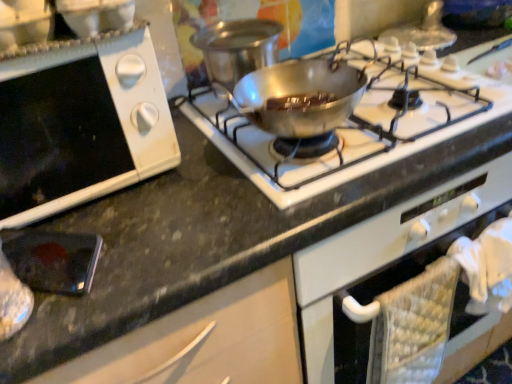
The width and height of the screenshot is (512, 384). What do you see at coordinates (80, 125) in the screenshot?
I see `white matte oven at lower left` at bounding box center [80, 125].

This screenshot has height=384, width=512. What do you see at coordinates (361, 131) in the screenshot?
I see `shiny silver pan at center` at bounding box center [361, 131].

Where is `white matte oven at lower left`? This screenshot has width=512, height=384. white matte oven at lower left is located at coordinates [80, 125].

How many degrees apart are the facing directions of metallic silver pan at center and white matte oven at lower left?

The angle between the facing direction of metallic silver pan at center and the facing direction of white matte oven at lower left is 0.000132 degrees.

Is metallic silver pan at center closer to camera compared to white matte oven at lower left?

No, it is behind white matte oven at lower left.

Which point is more distant from viewer, (242, 22) or (16, 109)?

The point (242, 22) is farther.

Is metallic silver pan at center far from white matte oven at lower left?

No, metallic silver pan at center is in close proximity to white matte oven at lower left.

Is shiny silver pan at center wider than white matte oven at lower left?

Correct, the width of shiny silver pan at center exceeds that of white matte oven at lower left.

How far apart are shiny silver pan at center and white matte oven at lower left?

shiny silver pan at center is 30.64 centimeters from white matte oven at lower left.

Is point (302, 199) positioned behind point (79, 123)?

Yes, point (302, 199) is behind point (79, 123).

Considering the sizes of objects shiny silver pan at center and white matte oven at lower left in the image provided, who is bigger, shiny silver pan at center or white matte oven at lower left?

white matte oven at lower left is bigger.

Does white matte oven at lower left have a smaller size compared to metallic silver phone at lower left?

No.

From the image's perspective, between white matte oven at lower left and metallic silver phone at lower left, which one is located above?

white matte oven at lower left, from the image's perspective.

Does point (37, 96) appear closer or farther from the camera than point (15, 272)?

Clearly, point (37, 96) is more distant from the camera than point (15, 272).

Find the location of `appliance that appears behind the white matte oven at lower left`. appliance that appears behind the white matte oven at lower left is located at coordinates (53, 259).

Is metallic silver phone at lower left facing towards white matte oven at lower left?

No, metallic silver phone at lower left does not turn towards white matte oven at lower left.

Does metallic silver phone at lower left have a greater width compared to white matte oven at lower left?

Incorrect, the width of metallic silver phone at lower left does not surpass that of white matte oven at lower left.

Consider the image. From a real-world perspective, between metallic silver phone at lower left and white matte oven at lower left, who is vertically higher?

white matte oven at lower left is physically above.

In the image, is metallic silver phone at lower left positioned in front of or behind white matte oven at lower left?

Visually, metallic silver phone at lower left is located behind white matte oven at lower left.

Is metallic silver pan at center positioned with its back to metallic silver phone at lower left?

No, metallic silver phone at lower left is not at the back of metallic silver pan at center.

Relative to metallic silver phone at lower left, is metallic silver pan at center in front or behind?

In the image, metallic silver pan at center appears behind metallic silver phone at lower left.

Is metallic silver phone at lower left inside metallic silver pan at center?

No, metallic silver pan at center does not contain metallic silver phone at lower left.

Based on their positions, is metallic silver pan at center located to the left or right of metallic silver phone at lower left?

From the image, it's evident that metallic silver pan at center is to the right of metallic silver phone at lower left.

Which of these two, white matte oven at lower left or shiny silver pan at center, stands shorter?

shiny silver pan at center.

This screenshot has width=512, height=384. In order to click on oven that is above the shiny silver pan at center (from a real-world perspective) in this screenshot , I will do `click(80, 125)`.

Does white matte oven at lower left turn towards shiny silver pan at center?

No.

From the image's perspective, is shiny silver pan at center beneath metallic silver pan at center?

Indeed, from the image's perspective, shiny silver pan at center is shown beneath metallic silver pan at center.

Can you confirm if shiny silver pan at center is positioned to the left of metallic silver pan at center?

Incorrect, shiny silver pan at center is not on the left side of metallic silver pan at center.

Considering the relative sizes of shiny silver pan at center and metallic silver pan at center in the image provided, is shiny silver pan at center bigger than metallic silver pan at center?

Yes.

Identify the location of oven on the left of metallic silver pan at center. (80, 125).

In order to click on oven that is below the shiny silver pan at center (from the image's perspective) in this screenshot , I will do `click(80, 125)`.

Considering their positions, is shiny silver pan at center positioned closer to white matte oven at lower left than metallic silver phone at lower left?

The object closer to white matte oven at lower left is metallic silver phone at lower left.

From the image, which object appears to be nearer to white matte oven at lower left, shiny silver pan at center or metallic silver pan at center?

metallic silver pan at center is positioned closer to the anchor white matte oven at lower left.

Looking at the image, which one is located further to metallic silver pan at center, metallic silver phone at lower left or white matte oven at lower left?

metallic silver phone at lower left is further to metallic silver pan at center.

Based on their spatial positions, is white matte oven at lower left or metallic silver pan at center closer to metallic silver phone at lower left?

Among the two, white matte oven at lower left is located nearer to metallic silver phone at lower left.

Which object lies further to the anchor point metallic silver phone at lower left, white matte oven at lower left or shiny silver pan at center?

shiny silver pan at center is further to metallic silver phone at lower left.

Consider the image. Looking at the image, which one is located further to shiny silver pan at center, metallic silver phone at lower left or metallic silver pan at center?

metallic silver phone at lower left lies further to shiny silver pan at center than the other object.

Estimate the real-world distances between objects in this image. Which object is further from shiny silver pan at center, metallic silver pan at center or white matte oven at lower left?

white matte oven at lower left.

From the image, which object appears to be farther from white matte oven at lower left, metallic silver phone at lower left or shiny silver pan at center?

The object further to white matte oven at lower left is shiny silver pan at center.

Where is `pot/pan between metallic silver phone at lower left and shiny silver pan at center in the horizontal direction`? pot/pan between metallic silver phone at lower left and shiny silver pan at center in the horizontal direction is located at coordinates (237, 48).

Locate an element on the screen. oven between metallic silver pan at center and metallic silver phone at lower left from top to bottom is located at coordinates (80, 125).

Image resolution: width=512 pixels, height=384 pixels. Identify the location of appliance located between white matte oven at lower left and shiny silver pan at center in the left-right direction. (53, 259).

The width and height of the screenshot is (512, 384). In order to click on pot/pan between white matte oven at lower left and shiny silver pan at center in this screenshot , I will do `click(237, 48)`.